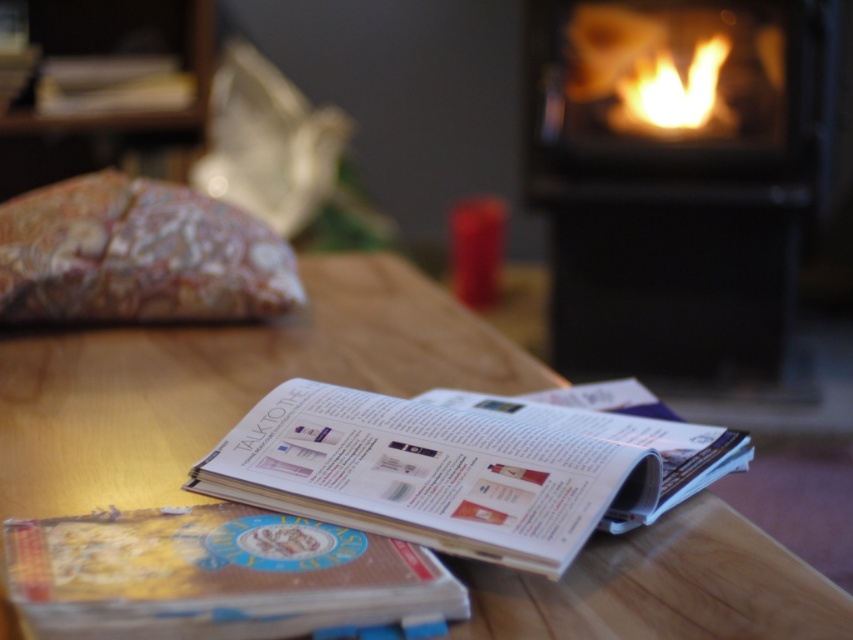
Question: Among these objects, which one is nearest to the camera?

Choices:
 (A) white glossy magazine at center
 (B) floral fabric pillow at upper left
 (C) black glossy fireplace at upper right
 (D) gold textured book at lower left

Answer: (D)

Question: Among these objects, which one is nearest to the camera?

Choices:
 (A) floral fabric pillow at upper left
 (B) white glossy magazine at center
 (C) black glossy fireplace at upper right
 (D) gold textured book at lower left

Answer: (D)

Question: Does white glossy magazine at center come in front of gold textured book at lower left?

Choices:
 (A) no
 (B) yes

Answer: (A)

Question: Which of these objects is positioned farthest from the floral fabric pillow at upper left?

Choices:
 (A) flamematerial/texture at upper right
 (B) black glossy fireplace at upper right

Answer: (A)

Question: Is black glossy fireplace at upper right wider than white glossy magazine at center?

Choices:
 (A) no
 (B) yes

Answer: (B)

Question: Where is black glossy fireplace at upper right located in relation to gold textured book at lower left in the image?

Choices:
 (A) below
 (B) above

Answer: (B)